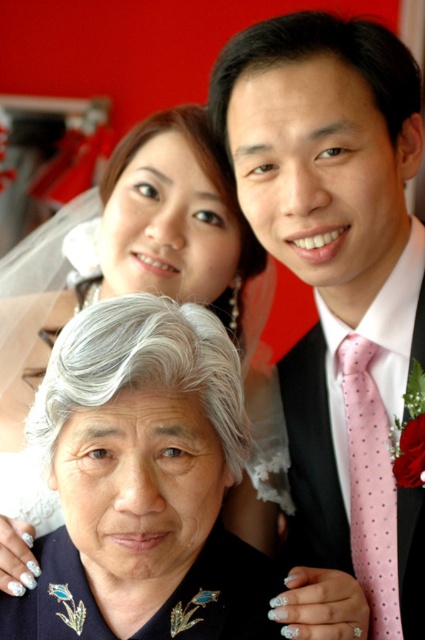
Question: Can you confirm if gray fabric at lower left is positioned to the right of pink dotted tie at right?

Choices:
 (A) no
 (B) yes

Answer: (A)

Question: Does pink dotted tie at center appear over pink dotted tie at right?

Choices:
 (A) yes
 (B) no

Answer: (A)

Question: Is pink dotted tie at center to the left of gray fabric at lower left from the viewer's perspective?

Choices:
 (A) no
 (B) yes

Answer: (A)

Question: Which point is farther to the camera?

Choices:
 (A) (243, 234)
 (B) (382, 406)
 (C) (385, 500)

Answer: (A)

Question: Which of the following is the closest to the observer?

Choices:
 (A) pink dotted tie at right
 (B) pink dotted tie at center

Answer: (B)

Question: Among these objects, which one is farthest from the camera?

Choices:
 (A) gray fabric at lower left
 (B) pink dotted tie at center
 (C) pink dotted tie at right

Answer: (C)